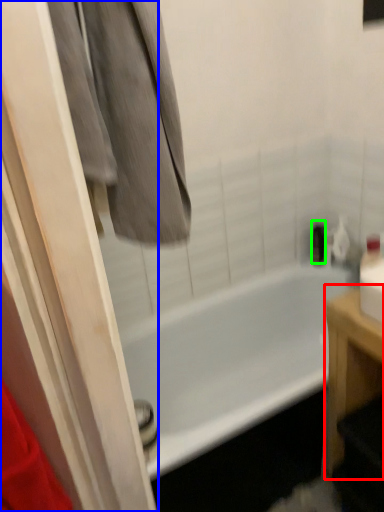
Question: Which is farther away from furniture (highlighted by a red box)? screen door (highlighted by a blue box) or toiletry (highlighted by a green box)?

Choices:
 (A) screen door
 (B) toiletry

Answer: (B)